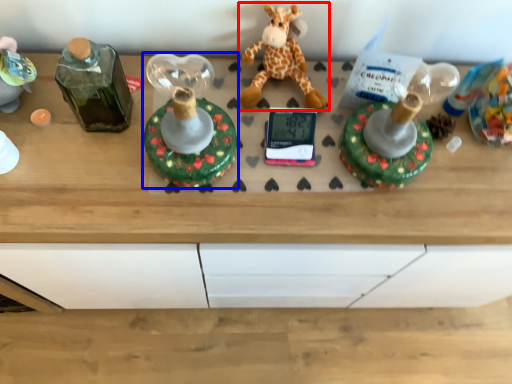
Question: Which object appears closest to the camera in this image, giraffe (highlighted by a red box) or toy (highlighted by a blue box)?

Choices:
 (A) giraffe
 (B) toy

Answer: (B)